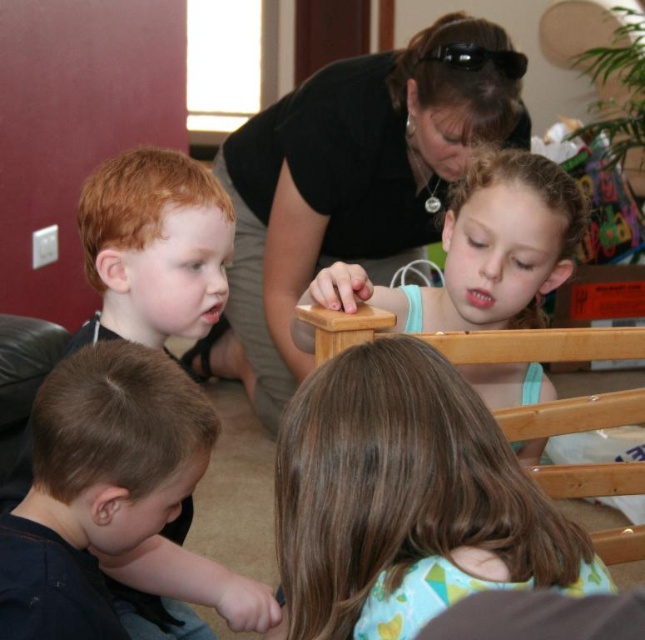
You are a photographer trying to capture a clear photo of the brown smooth shirt at lower left without the black matte shirt at upper center blocking it. How should you adjust your position?

Move your camera position behind the brown smooth shirt at lower left so that it is no longer behind the black matte shirt at upper center.

In the scene described, there are two shirts visible. The black matte shirt at upper center and the brown smooth shirt at lower left. From an observer standing in front of the image, which shirt is positioned to the right of the other?

The black matte shirt at upper center is to the right of the brown smooth shirt at lower left.